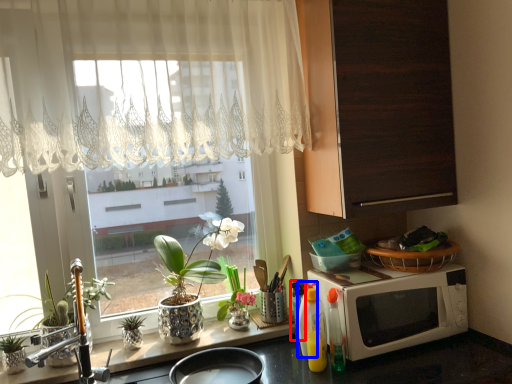
Question: Which object appears farthest to the camera in this image, bottle (highlighted by a red box) or bottle (highlighted by a blue box)?

Choices:
 (A) bottle
 (B) bottle

Answer: (A)